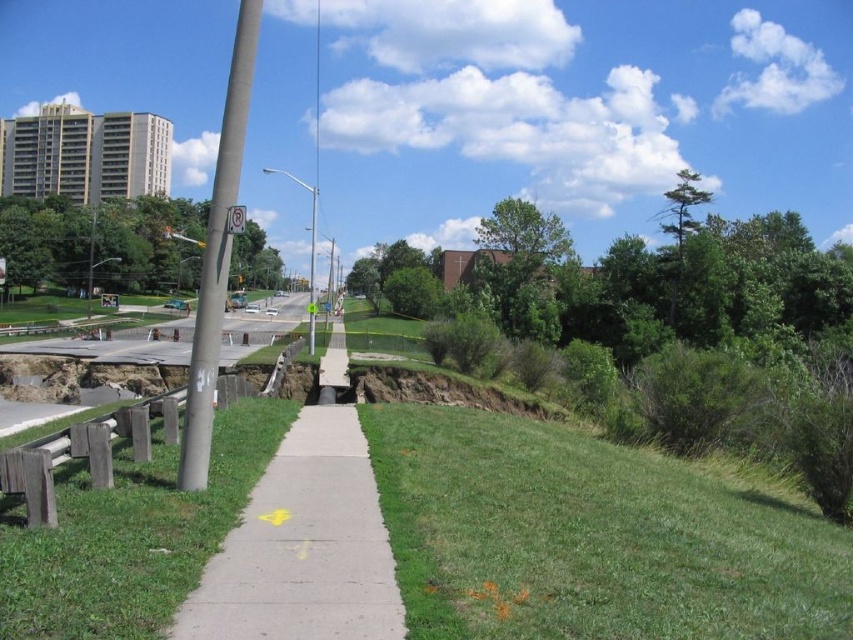
Question: Which of these objects is positioned closest to the concrete sidewalk at center?

Choices:
 (A) green grass at lower left
 (B) green grassy at lower right

Answer: (B)

Question: Can you confirm if green grassy at lower right is bigger than concrete sidewalk at center?

Choices:
 (A) no
 (B) yes

Answer: (B)

Question: Does green grassy at lower right appear on the right side of concrete pole at left?

Choices:
 (A) yes
 (B) no

Answer: (A)

Question: Which of the following is the closest to the observer?

Choices:
 (A) (70, 602)
 (B) (225, 106)

Answer: (A)

Question: Can you confirm if green grassy at lower right is positioned to the left of concrete sidewalk at center?

Choices:
 (A) yes
 (B) no

Answer: (B)

Question: Which of the following is the farthest from the observer?

Choices:
 (A) concrete pole at left
 (B) green plastic sign at upper center
 (C) green grassy at lower right

Answer: (A)